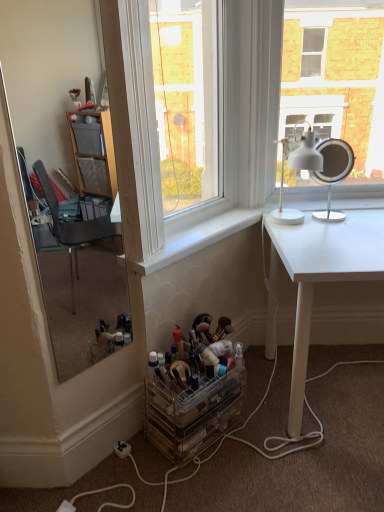
At what (x,y) coordinates should I click in order to perform the action: click on free point in front of white plastic power outlet at lower center. Please return your answer as a coordinate pair (x, y). This screenshot has width=384, height=512. Looking at the image, I should click on tap(117, 484).